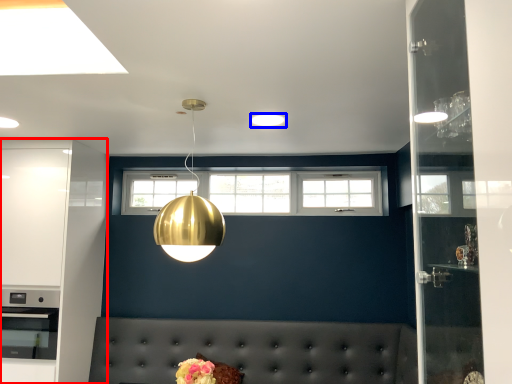
Question: Which of the following is the closest to the observer, cabinetry (highlighted by a red box) or lighting (highlighted by a blue box)?

Choices:
 (A) cabinetry
 (B) lighting

Answer: (B)